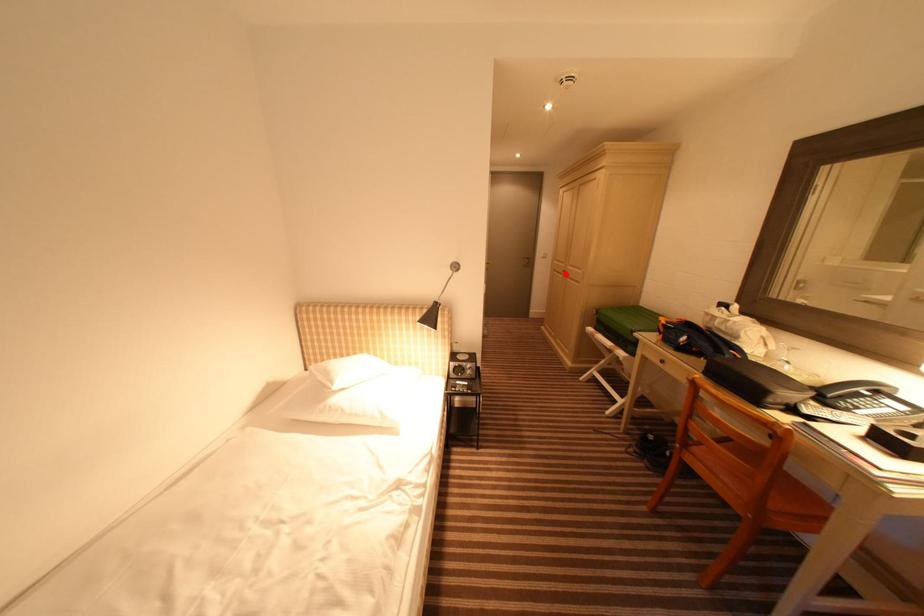
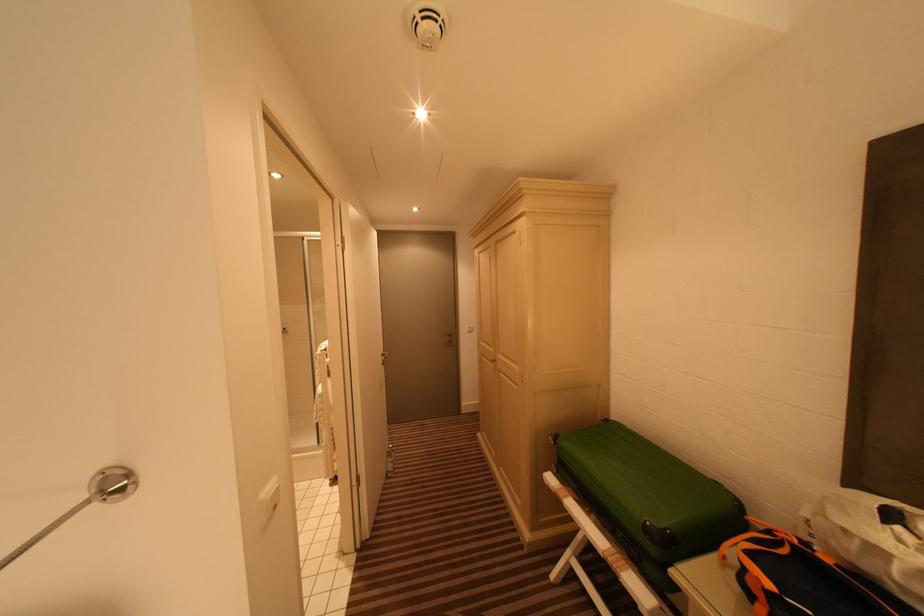
Question: I am providing you with two images of the same scene from different viewpoints. In image1, a red point is highlighted. Considering the same 3D point in image2, which of the following is correct?

Choices:
 (A) It is closer
 (B) It is farther

Answer: (B)